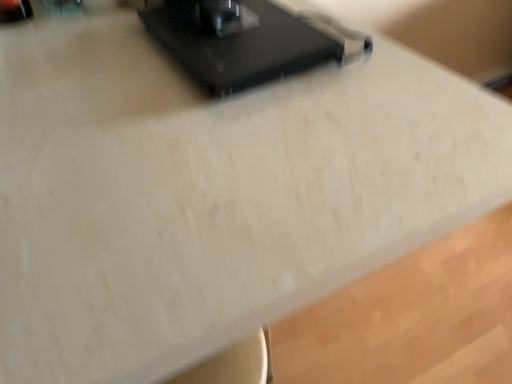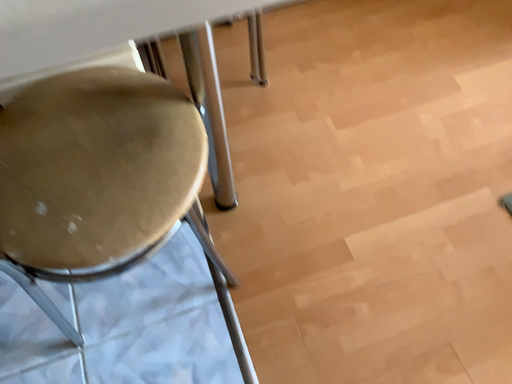
Question: How did the camera likely rotate when shooting the video?

Choices:
 (A) rotated upward
 (B) rotated downward

Answer: (B)